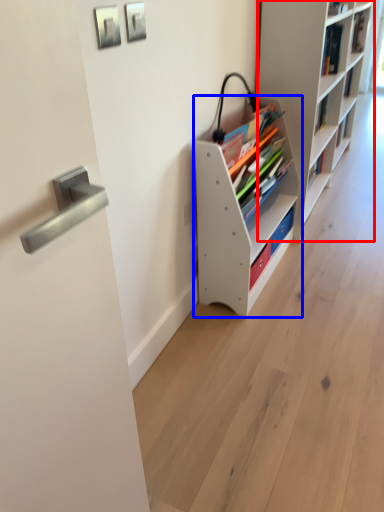
Question: Which point is closer to the camera, shelf (highlighted by a red box) or shelf (highlighted by a blue box)?

Choices:
 (A) shelf
 (B) shelf

Answer: (B)